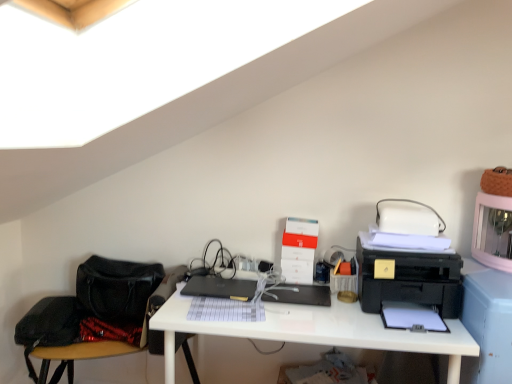
At what (x,y) coordinates should I click in order to perform the action: click on free point below black plastic register at center (from a real-world perspective). Please return your answer as a coordinate pair (x, y). Looking at the image, I should click on (296, 302).